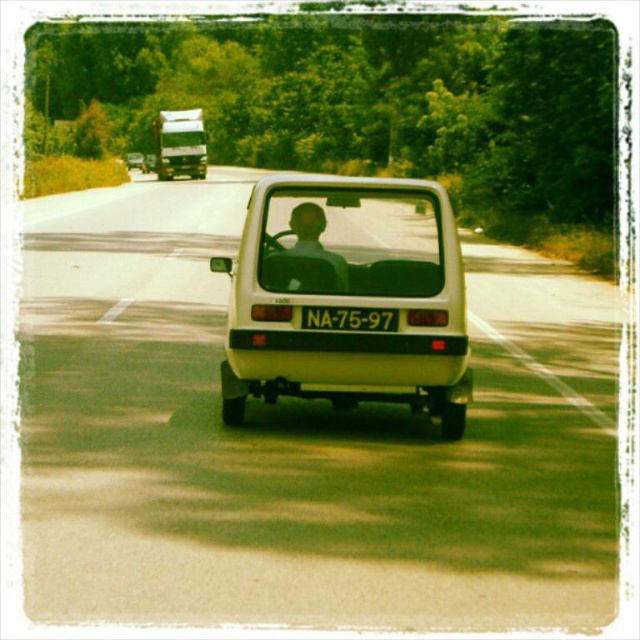
Question: Which point is closer to the camera taking this photo?

Choices:
 (A) (292, 228)
 (B) (296, 276)
 (C) (364, 326)
 (D) (200, 148)

Answer: (C)

Question: From the image, what is the correct spatial relationship of white matte van at center in relation to matte white truck at upper left?

Choices:
 (A) above
 (B) below

Answer: (B)

Question: Among these points, which one is nearest to the camera?

Choices:
 (A) (394, 328)
 (B) (189, 116)
 (C) (310, 216)
 (D) (298, 205)

Answer: (A)

Question: Is white matte van at center smaller than matte white truck at upper left?

Choices:
 (A) yes
 (B) no

Answer: (A)

Question: Does white matte van at center have a greater width compared to black plastic license plate at rear?

Choices:
 (A) no
 (B) yes

Answer: (B)

Question: Among these objects, which one is farthest from the camera?

Choices:
 (A) matte white truck at upper left
 (B) matte black shirt at rear
 (C) black plastic license plate at rear

Answer: (A)